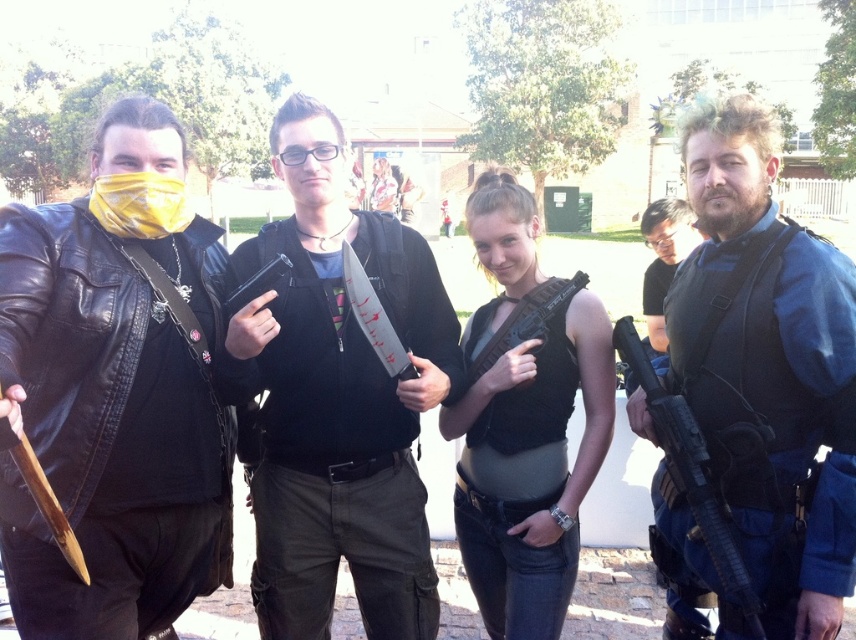
Is black matte jacket at center further to the viewer compared to black matte rifle at right?

Yes, black matte jacket at center is behind black matte rifle at right.

Between black matte jacket at center and black matte rifle at right, which one has less height?

black matte rifle at right is shorter.

Does point (294, 612) come farther from viewer compared to point (697, 480)?

Yes, it is behind point (697, 480).

The width and height of the screenshot is (856, 640). What are the coordinates of `black matte jacket at center` in the screenshot? It's located at (337, 397).

Can you confirm if matte black tank top at center is thinner than blue tactical vest at right?

No.

The height and width of the screenshot is (640, 856). In order to click on matte black tank top at center in this screenshot , I will do `click(114, 397)`.

Can you confirm if blue tactical vest at right is smaller than matte black vest at right?

Yes.

Between point (817, 308) and point (657, 289), which one is positioned in front?

Point (817, 308) is more forward.

You are a GUI agent. You are given a task and a screenshot of the screen. Output one action in this format:
    pyautogui.click(x=<x>, y=<y>)
    Task: Click on the blue tactical vest at right
    The width and height of the screenshot is (856, 640).
    Given the screenshot: What is the action you would take?
    pyautogui.click(x=767, y=369)